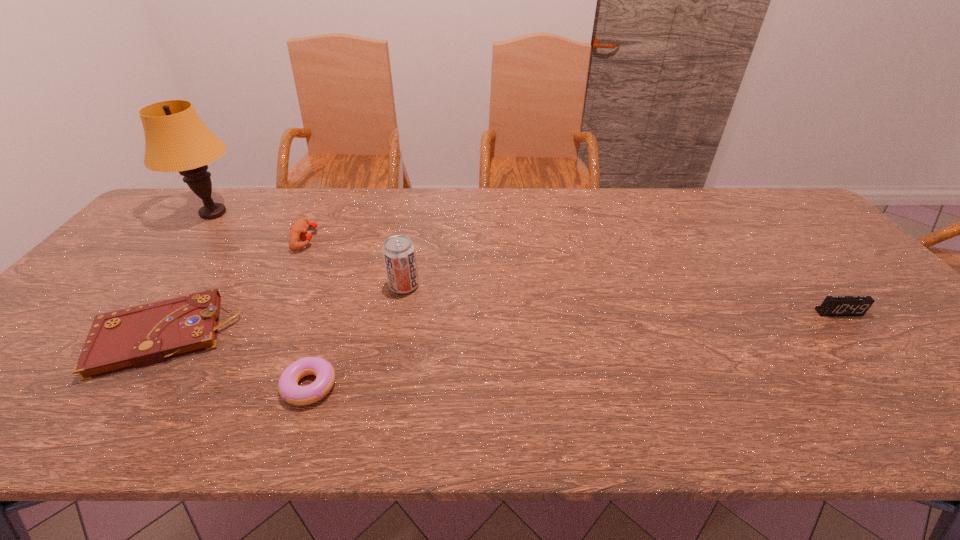
Locate an element on the screen. The height and width of the screenshot is (540, 960). free point at the far edge is located at coordinates (601, 204).

Where is `free region at the near edge of the desktop`? Image resolution: width=960 pixels, height=540 pixels. free region at the near edge of the desktop is located at coordinates (892, 404).

The height and width of the screenshot is (540, 960). Identify the location of vacant space at the right edge. (815, 230).

At what (x,y) coordinates should I click in order to perform the action: click on vacant space at the far right corner of the desktop. Please return your answer as a coordinate pair (x, y). The width and height of the screenshot is (960, 540). Looking at the image, I should click on (758, 206).

Locate an element on the screen. The height and width of the screenshot is (540, 960). free area in between the lampshade and the fourth object from right to left is located at coordinates (260, 226).

Find the location of a particular element. free area in between the fourth object from right to left and the lampshade is located at coordinates (260, 226).

The height and width of the screenshot is (540, 960). What are the coordinates of `free point between the third object from right to left and the notebook` in the screenshot? It's located at (236, 361).

This screenshot has height=540, width=960. I want to click on vacant space that is in between the fourth nearest object and the doughnut, so click(356, 335).

Where is `blank region between the notebook and the fourth object from left to right`? The image size is (960, 540). blank region between the notebook and the fourth object from left to right is located at coordinates (236, 361).

Image resolution: width=960 pixels, height=540 pixels. What are the coordinates of `blank region between the third object from right to left and the alarm clock` in the screenshot? It's located at (574, 349).